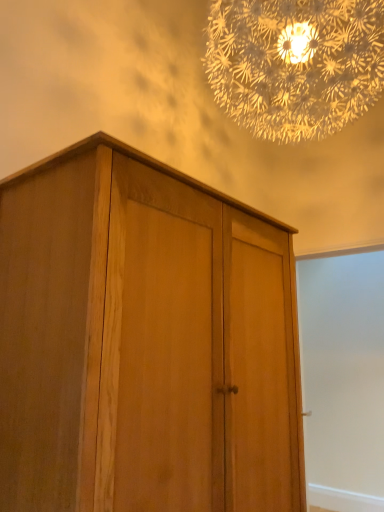
Question: Considering the relative positions of white matte screen door at right and natural wood cupboard at center in the image provided, is white matte screen door at right to the left or to the right of natural wood cupboard at center?

Choices:
 (A) right
 (B) left

Answer: (A)

Question: Is white matte screen door at right in front of or behind natural wood cupboard at center in the image?

Choices:
 (A) behind
 (B) front

Answer: (A)

Question: Which object is the closest to the natural wood cupboard at center?

Choices:
 (A) white matte screen door at right
 (B) translucent glass chandelier at upper center

Answer: (B)

Question: Which object is the closest to the white matte screen door at right?

Choices:
 (A) natural wood cupboard at center
 (B) translucent glass chandelier at upper center

Answer: (B)